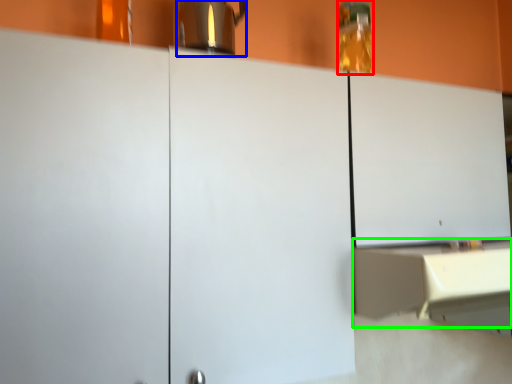
Question: Based on their relative distances, which object is nearer to bottle (highlighted by a red box)? Choose from coffeepot (highlighted by a blue box) and counter (highlighted by a green box).

Choices:
 (A) coffeepot
 (B) counter

Answer: (A)